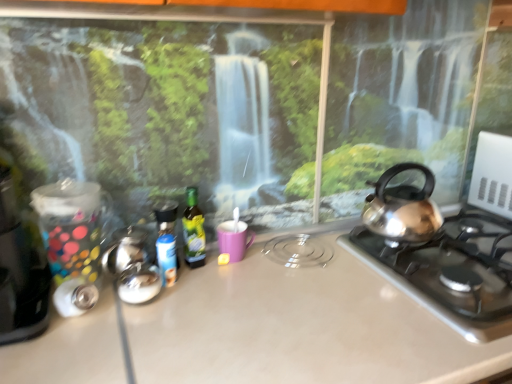
Question: Does metallic silver canister at left have a larger size compared to green glass bottle at center, arranged as the 1th bottle when viewed from the right?

Choices:
 (A) yes
 (B) no

Answer: (A)

Question: Can you confirm if metallic silver canister at left is taller than green glass bottle at center, the 2th bottle in the left-to-right sequence?

Choices:
 (A) yes
 (B) no

Answer: (A)

Question: Does metallic silver canister at left have a lesser height compared to green glass bottle at center, arranged as the 1th bottle when viewed from the right?

Choices:
 (A) no
 (B) yes

Answer: (A)

Question: Can you confirm if metallic silver canister at left is smaller than green glass bottle at center, the 2th bottle in the left-to-right sequence?

Choices:
 (A) no
 (B) yes

Answer: (A)

Question: Can you confirm if metallic silver canister at left is wider than green glass bottle at center, the 2th bottle in the left-to-right sequence?

Choices:
 (A) yes
 (B) no

Answer: (A)

Question: Visually, is metallic silver canister at left positioned to the left or to the right of blue plastic bottle at center, arranged as the second bottle when viewed from the right?

Choices:
 (A) left
 (B) right

Answer: (A)

Question: Considering the positions of metallic silver canister at left and blue plastic bottle at center, the first bottle in the left-to-right sequence, in the image, is metallic silver canister at left taller or shorter than blue plastic bottle at center, the first bottle in the left-to-right sequence,?

Choices:
 (A) tall
 (B) short

Answer: (A)

Question: From the image's perspective, is metallic silver canister at left above or below blue plastic bottle at center, the first bottle in the left-to-right sequence?

Choices:
 (A) below
 (B) above

Answer: (B)

Question: In terms of width, does metallic silver canister at left look wider or thinner when compared to blue plastic bottle at center, the first bottle in the left-to-right sequence?

Choices:
 (A) wide
 (B) thin

Answer: (A)

Question: Considering their positions, is blue plastic bottle at center, the first bottle in the left-to-right sequence, located in front of or behind green glass bottle at center, the 2th bottle in the left-to-right sequence?

Choices:
 (A) behind
 (B) front

Answer: (B)

Question: From the image's perspective, relative to green glass bottle at center, the 2th bottle in the left-to-right sequence, is blue plastic bottle at center, arranged as the second bottle when viewed from the right, above or below?

Choices:
 (A) below
 (B) above

Answer: (A)

Question: Is blue plastic bottle at center, arranged as the second bottle when viewed from the right, wider or thinner than green glass bottle at center, arranged as the 1th bottle when viewed from the right?

Choices:
 (A) thin
 (B) wide

Answer: (B)

Question: Is point (170, 218) closer or farther from the camera than point (189, 231)?

Choices:
 (A) farther
 (B) closer

Answer: (A)

Question: Is point (231, 225) closer or farther from the camera than point (468, 211)?

Choices:
 (A) closer
 (B) farther

Answer: (A)

Question: Looking at the image, does matte purple mug at center seem bigger or smaller compared to satin silver gas stove at right?

Choices:
 (A) small
 (B) big

Answer: (A)